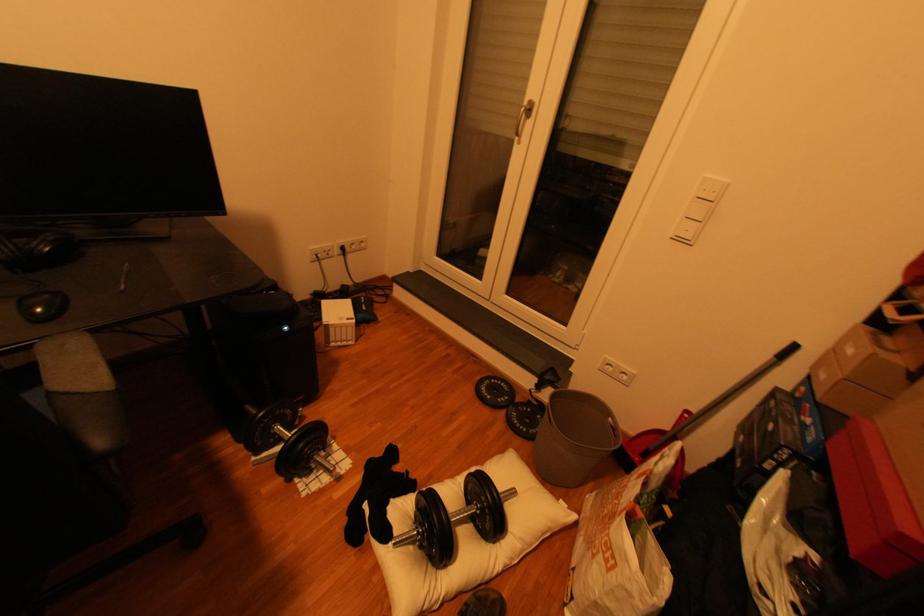
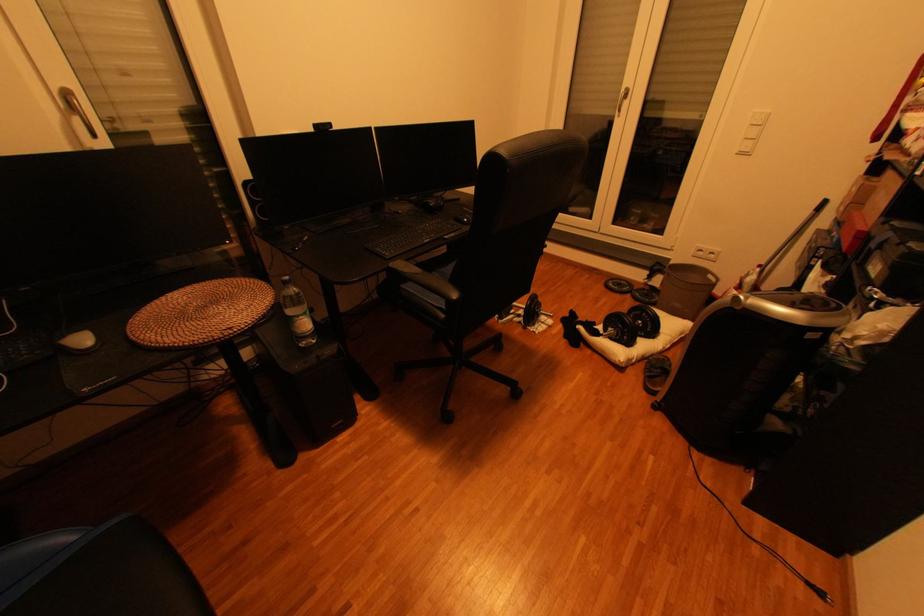
In the second image, find the point that corresponds to point (358, 472) in the first image.

(564, 323)